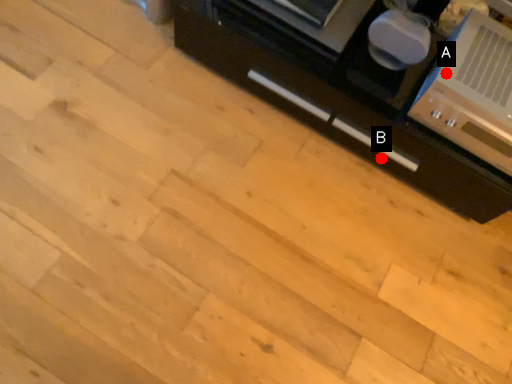
Question: Two points are circled on the image, labeled by A and B beside each circle. Which point is farther to the camera?

Choices:
 (A) A is further
 (B) B is further

Answer: (B)